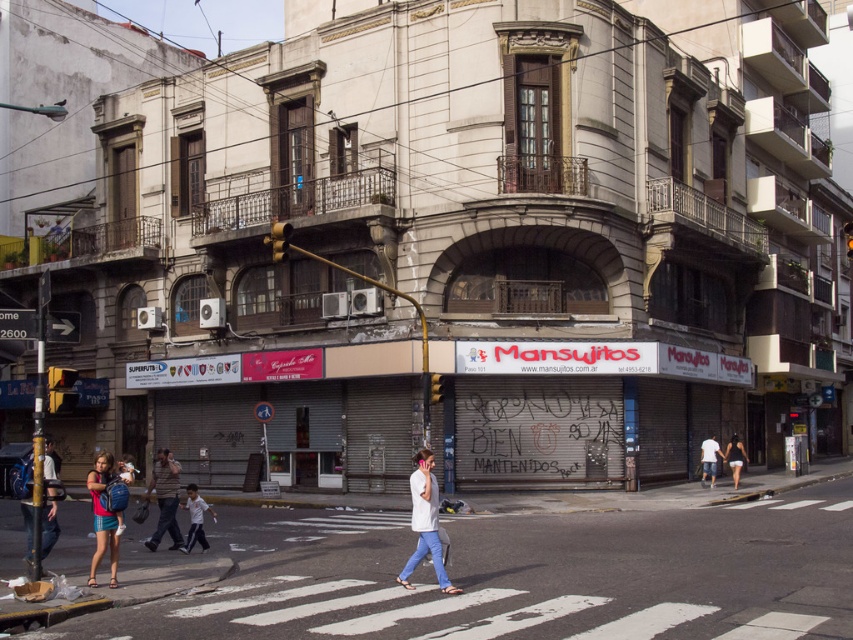
You are standing on the street in front of the Mansujitos building. There are two points marked on the ground. The first point is at coordinate point (169, 529) and the second is at point (189, 490). From your perspective, which point is closer to you?

Point (169, 529) is in front of point (189, 490), so it is closer to you.